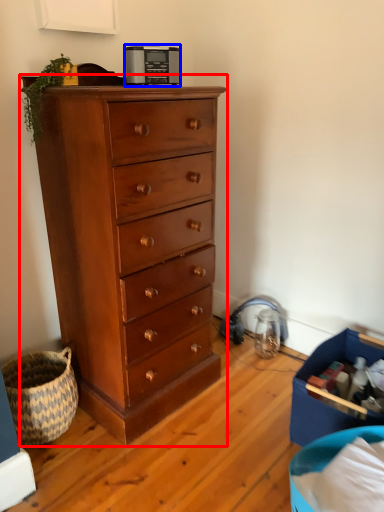
Question: Which object is closer to the camera taking this photo, chest of drawers (highlighted by a red box) or appliance (highlighted by a blue box)?

Choices:
 (A) chest of drawers
 (B) appliance

Answer: (A)